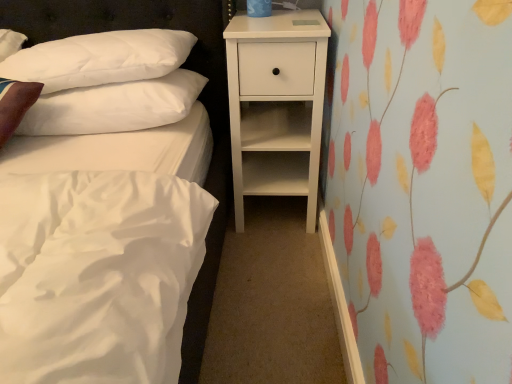
Question: Choose the correct answer: Is white matte nightstand at center inside white soft pillow at upper left, acting as the 1th pillow starting from the top, or outside it?

Choices:
 (A) inside
 (B) outside

Answer: (B)

Question: Considering the positions of point (243, 34) and point (155, 54), is point (243, 34) closer or farther from the camera than point (155, 54)?

Choices:
 (A) farther
 (B) closer

Answer: (B)

Question: Based on their relative distances, which object is nearer to the white matte nightstand at center?

Choices:
 (A) white soft pillow at upper left, acting as the 1th pillow starting from the top
 (B) white soft pillow at upper left, positioned as the first pillow in bottom-to-top order

Answer: (B)

Question: Based on their relative distances, which object is nearer to the white matte nightstand at center?

Choices:
 (A) white soft pillow at upper left, acting as the 1th pillow starting from the top
 (B) white soft pillow at upper left, positioned as the first pillow in bottom-to-top order

Answer: (B)